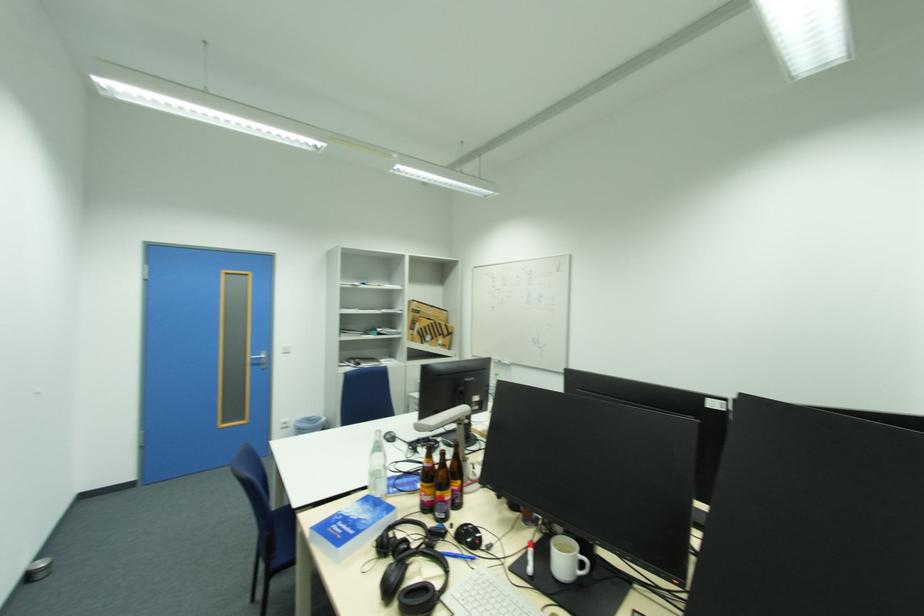
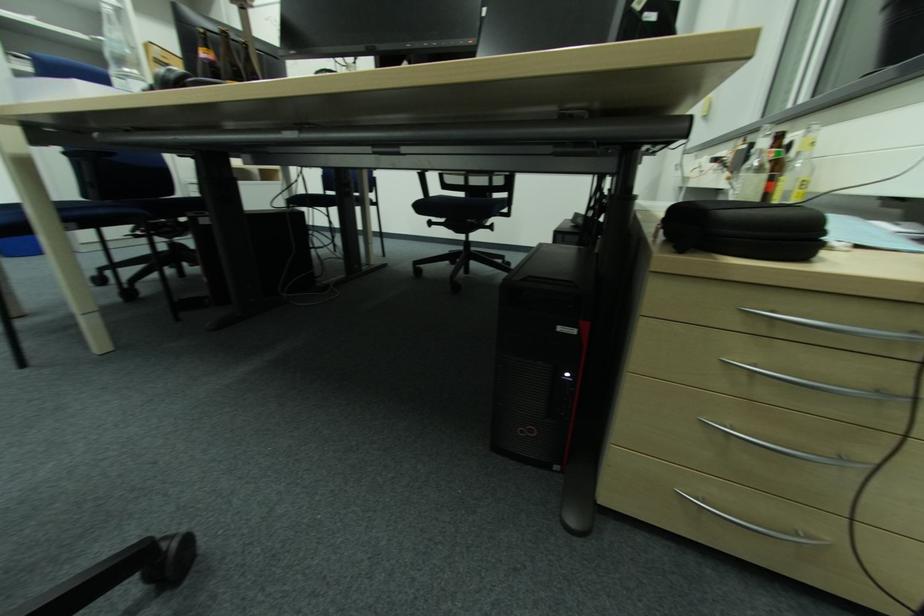
How did the camera likely rotate?

The camera rotated toward right-down.